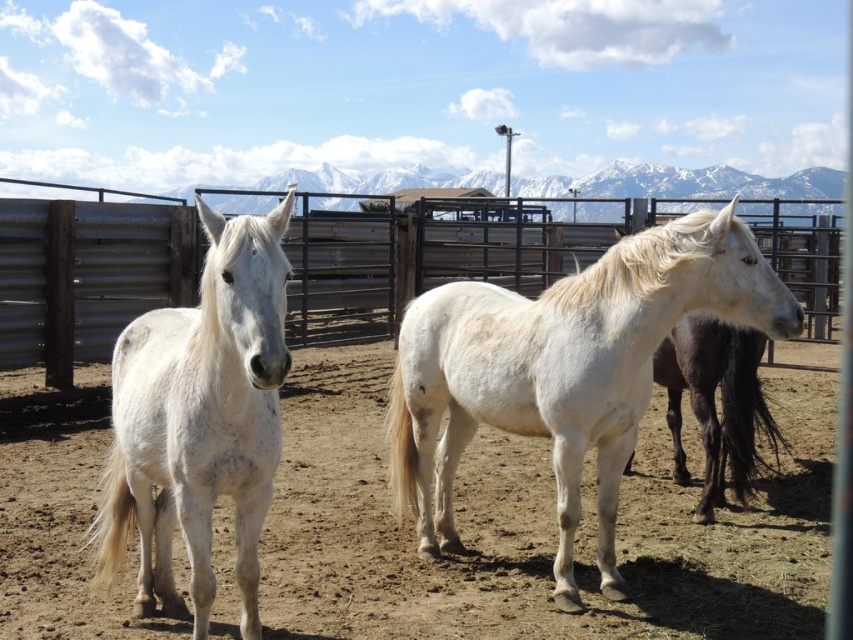
You are standing at a point 42.74 feet away from the point marked as point (315, 225) in the image. You want to observe the three horses in the fenced area. Can you see the third horse positioned further back and to the right in the background from your current position?

Yes, since you are 42.74 feet away from point (315, 225), which is the location of the third horse positioned further back and to the right in the background, you can see it from your current position as it is part of the scene described.

You are a farmer checking the fence line in the field. You see the metallic corrugated fence at center and the white matte horse at left. Which object is higher in the image?

The metallic corrugated fence at center is located above the white matte horse at left, so it is higher in the image.

You are a photographer standing at the camera position. You want to take a closeup photo of the white matte horse at center. Given that your camera has a minimum focusing distance of 3 meters, will you be able to take the photo without moving closer?

The white matte horse at center is 3.65 meters away from the camera. Since the minimum focusing distance is 3 meters, the camera can focus on the white matte horse at center because 3.65 meters is beyond the minimum requirement.